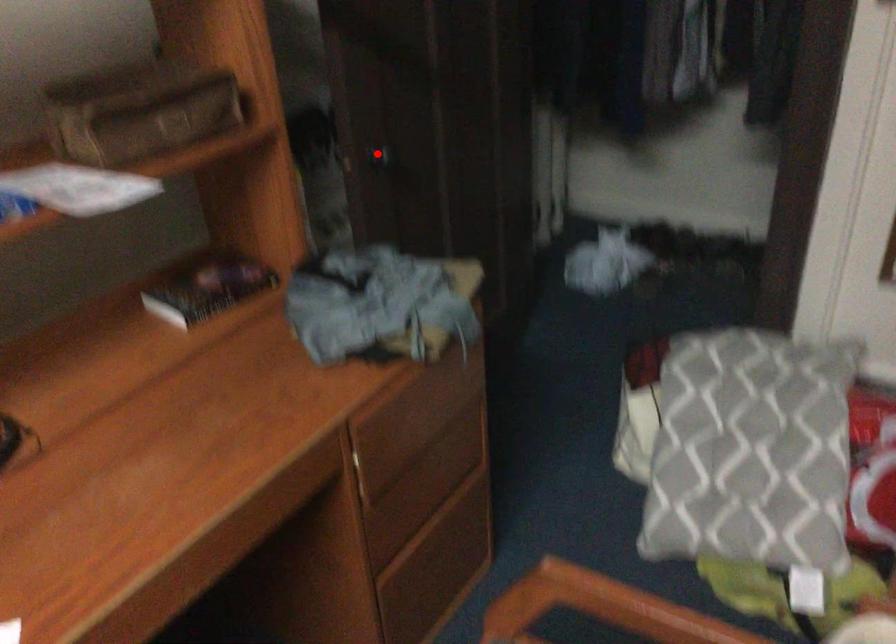
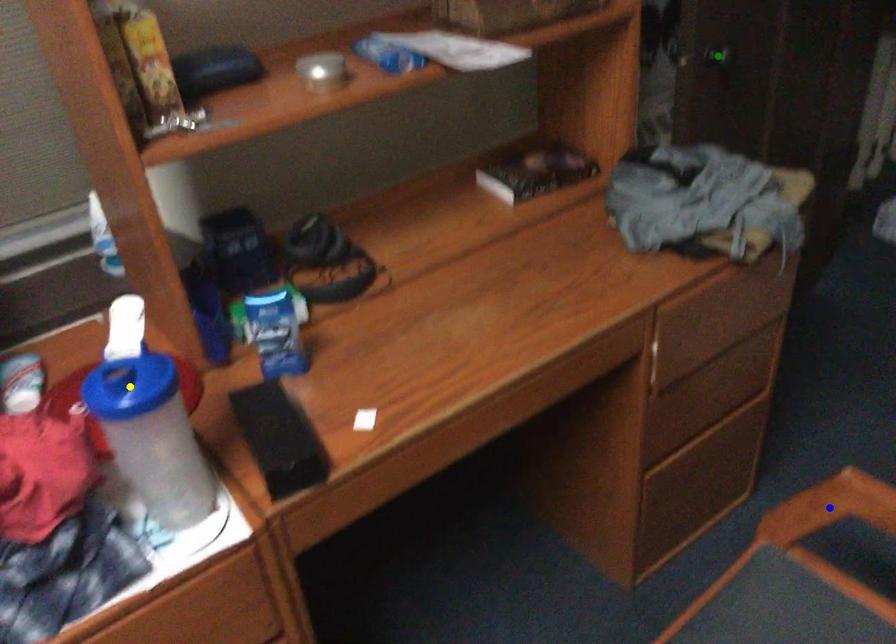
Question: I am providing you with two images of the same scene from different viewpoints. A red point is marked on the first image. You are given multiple points on the second image. Which point in image 2 represents the same 3d spot as the red point in image 1?

Choices:
 (A) yellow point
 (B) blue point
 (C) green point

Answer: (C)